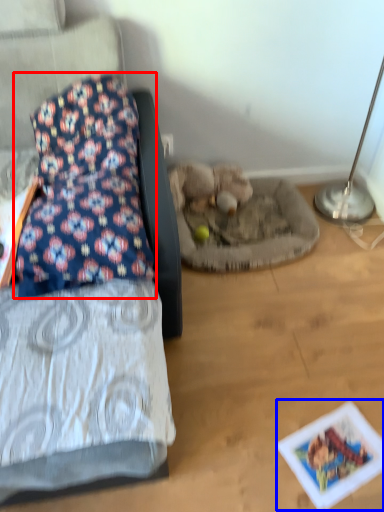
Question: Which object appears farthest to the camera in this image, pillow (highlighted by a red box) or postcard (highlighted by a blue box)?

Choices:
 (A) pillow
 (B) postcard

Answer: (B)